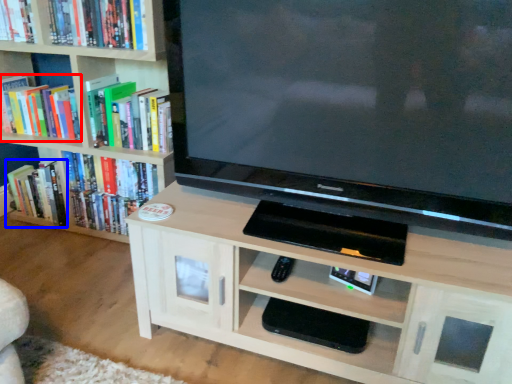
Question: Which object appears closest to the camera in this image, book (highlighted by a red box) or book (highlighted by a blue box)?

Choices:
 (A) book
 (B) book

Answer: (A)